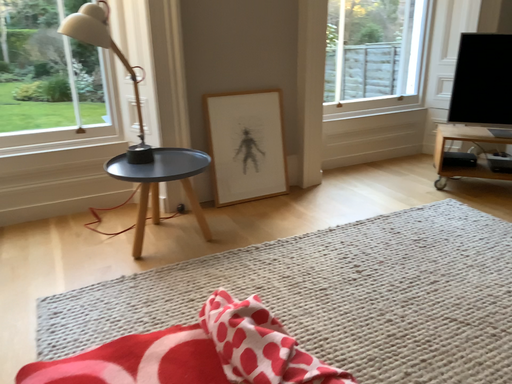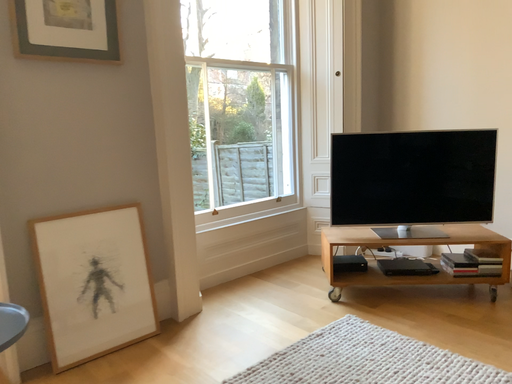
Question: Which way did the camera rotate in the video?

Choices:
 (A) rotated downward
 (B) rotated upward

Answer: (B)